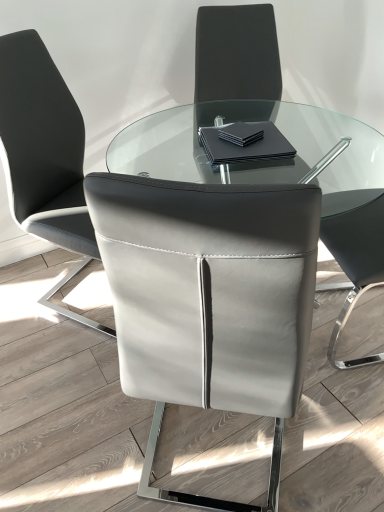
This screenshot has width=384, height=512. What are the coordinates of `vacant region below white leather chair at center, positioned as the first chair in left-to-right order (from a real-world perspective)` in the screenshot? It's located at (83, 288).